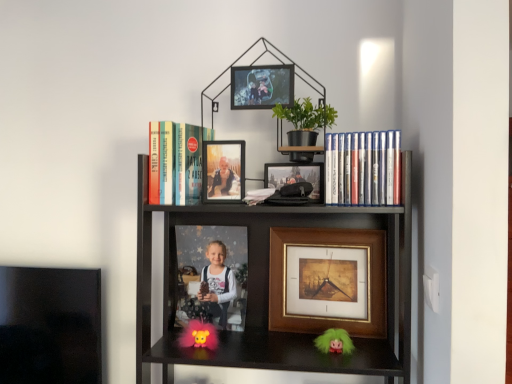
Question: Is matte plastic photo frame at center, acting as the 2th picture frame starting from the bottom, at the back of silver metallic dvds at right, arranged as the first book when viewed from the right?

Choices:
 (A) yes
 (B) no

Answer: (B)

Question: Is silver metallic dvds at right, arranged as the first book when viewed from the right, to the right of matte plastic photo frame at center, the third picture frame when ordered from top to bottom, from the viewer's perspective?

Choices:
 (A) yes
 (B) no

Answer: (A)

Question: Does silver metallic dvds at right, the 2th book when ordered from left to right, have a lesser width compared to matte plastic photo frame at center, the third picture frame when ordered from top to bottom?

Choices:
 (A) no
 (B) yes

Answer: (B)

Question: Can you confirm if silver metallic dvds at right, arranged as the first book when viewed from the right, is shorter than matte plastic photo frame at center, the third picture frame when ordered from top to bottom?

Choices:
 (A) yes
 (B) no

Answer: (A)

Question: Is matte plastic photo frame at center, the third picture frame when ordered from top to bottom, located within silver metallic dvds at right, the 2th book when ordered from left to right?

Choices:
 (A) no
 (B) yes

Answer: (A)

Question: Is the position of silver metallic dvds at right, arranged as the first book when viewed from the right, less distant than that of matte plastic photo frame at center, positioned as the 1th picture frame in back-to-front order?

Choices:
 (A) yes
 (B) no

Answer: (A)

Question: From a real-world perspective, is metallic silver picture frame at upper center, acting as the first picture frame starting from the front, over black matte bookcase at center?

Choices:
 (A) no
 (B) yes

Answer: (B)

Question: Considering the relative positions of metallic silver picture frame at upper center, arranged as the 4th picture frame when viewed from the back, and black matte bookcase at center in the image provided, is metallic silver picture frame at upper center, arranged as the 4th picture frame when viewed from the back, to the left of black matte bookcase at center from the viewer's perspective?

Choices:
 (A) no
 (B) yes

Answer: (B)

Question: Is metallic silver picture frame at upper center, arranged as the 4th picture frame when viewed from the back, outside of black matte bookcase at center?

Choices:
 (A) yes
 (B) no

Answer: (A)

Question: Is metallic silver picture frame at upper center, marked as the first picture frame in a top-to-bottom arrangement, positioned behind black matte bookcase at center?

Choices:
 (A) no
 (B) yes

Answer: (B)

Question: From the image's perspective, is metallic silver picture frame at upper center, marked as the first picture frame in a top-to-bottom arrangement, under black matte bookcase at center?

Choices:
 (A) no
 (B) yes

Answer: (A)

Question: Is metallic silver picture frame at upper center, arranged as the 4th picture frame when viewed from the back, facing away from black matte bookcase at center?

Choices:
 (A) yes
 (B) no

Answer: (B)

Question: Considering the relative sizes of matte plastic photo frame at center, the third picture frame when ordered from top to bottom, and fluffy pink toy at center in the image provided, is matte plastic photo frame at center, the third picture frame when ordered from top to bottom, taller than fluffy pink toy at center?

Choices:
 (A) no
 (B) yes

Answer: (B)